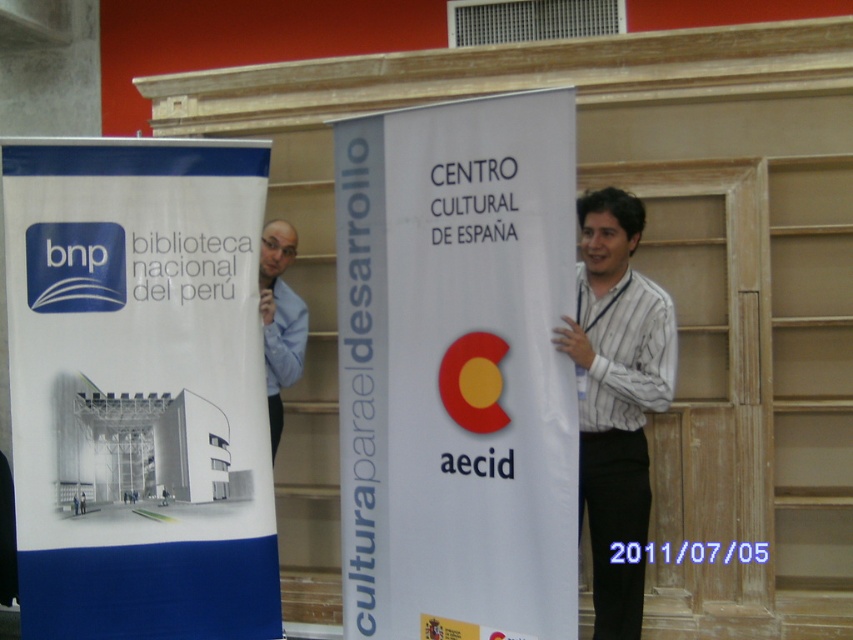
Question: Which point is farther to the camera?

Choices:
 (A) white paper banner at center
 (B) white striped shirt at center
 (C) blue shirt at left
 (D) white paper poster at left

Answer: (C)

Question: Which object is closer to the camera taking this photo?

Choices:
 (A) white paper poster at left
 (B) blue shirt at left
 (C) white paper banner at center

Answer: (C)

Question: From the image, what is the correct spatial relationship of white paper poster at left in relation to white paper banner at center?

Choices:
 (A) right
 (B) left

Answer: (B)

Question: Is white paper poster at left to the right of blue shirt at left from the viewer's perspective?

Choices:
 (A) yes
 (B) no

Answer: (B)

Question: Which is farther from the white paper poster at left?

Choices:
 (A) white striped shirt at center
 (B) white paper banner at center

Answer: (A)

Question: Is white paper poster at left to the right of blue shirt at left from the viewer's perspective?

Choices:
 (A) no
 (B) yes

Answer: (A)